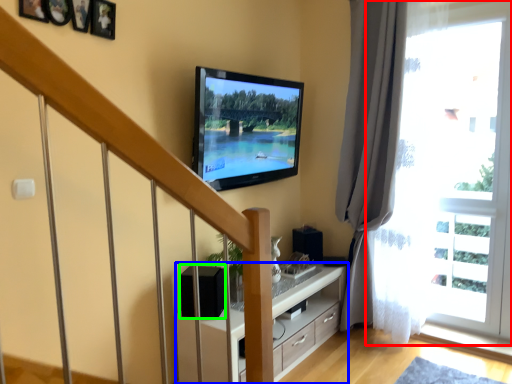
Question: Based on their relative distances, which object is nearer to window (highlighted by a red box)? Choose from cabinetry (highlighted by a blue box) and speaker (highlighted by a green box).

Choices:
 (A) cabinetry
 (B) speaker

Answer: (A)